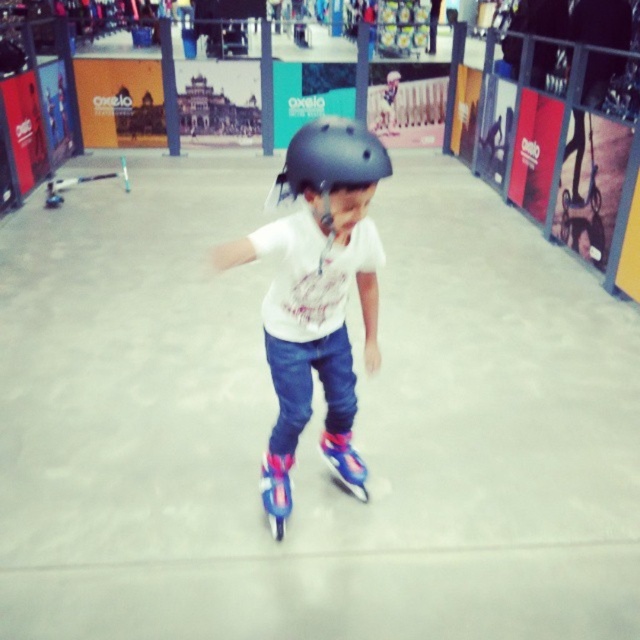
Is matte black helmet at center bigger than pink glossy roller skate at center?

Yes, matte black helmet at center is bigger than pink glossy roller skate at center.

Which is more to the right, matte black helmet at center or pink glossy roller skate at center?

Positioned to the right is pink glossy roller skate at center.

The image size is (640, 640). What do you see at coordinates (320, 284) in the screenshot?
I see `matte black helmet at center` at bounding box center [320, 284].

Where is `matte black helmet at center`? matte black helmet at center is located at coordinates (320, 284).

Does pink plastic roller skate at center appear on the right side of pink glossy roller skate at center?

No, pink plastic roller skate at center is not to the right of pink glossy roller skate at center.

Locate an element on the screen. pink plastic roller skate at center is located at coordinates (276, 492).

I want to click on pink plastic roller skate at center, so (276, 492).

Who is lower down, black matte helmet at center or pink glossy roller skate at center?

pink glossy roller skate at center is below.

Measure the distance between point (355,125) and camera.

The distance of point (355,125) from camera is 1.62 meters.

Between point (296, 184) and point (362, 465), which one is positioned in front?

Point (296, 184) is in front.

Find the location of a particular element. The width and height of the screenshot is (640, 640). black matte helmet at center is located at coordinates (330, 163).